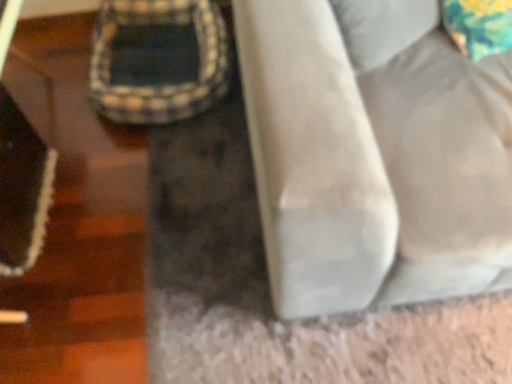
Question: In terms of height, does plush beige bean bag at center look taller or shorter compared to suede-like beige couch at lower right?

Choices:
 (A) tall
 (B) short

Answer: (B)

Question: Is point (117, 114) closer or farther from the camera than point (338, 89)?

Choices:
 (A) farther
 (B) closer

Answer: (A)

Question: From a real-world perspective, relative to suede-like beige couch at lower right, is plush beige bean bag at center vertically above or below?

Choices:
 (A) above
 (B) below

Answer: (B)

Question: From a real-world perspective, relative to plush beige bean bag at center, is suede-like beige couch at lower right vertically above or below?

Choices:
 (A) above
 (B) below

Answer: (A)

Question: Relative to plush beige bean bag at center, is suede-like beige couch at lower right in front or behind?

Choices:
 (A) front
 (B) behind

Answer: (A)

Question: From the image's perspective, is suede-like beige couch at lower right located above or below plush beige bean bag at center?

Choices:
 (A) below
 (B) above

Answer: (A)

Question: Is suede-like beige couch at lower right bigger or smaller than plush beige bean bag at center?

Choices:
 (A) small
 (B) big

Answer: (B)